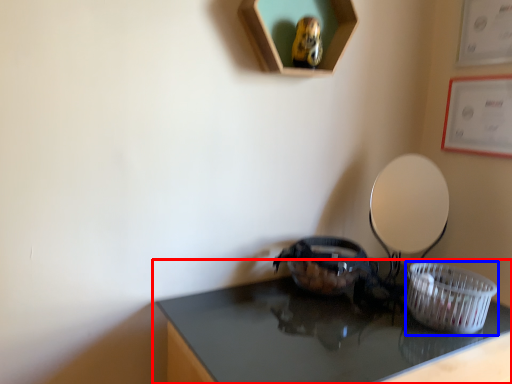
Question: Which object is closer to the camera taking this photo, table (highlighted by a red box) or basket (highlighted by a blue box)?

Choices:
 (A) table
 (B) basket

Answer: (A)